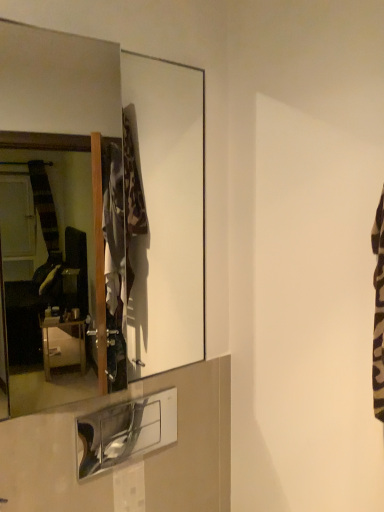
Question: From the image's perspective, is metallic silver shelf at lower center on top of matte glass mirror at upper left?

Choices:
 (A) yes
 (B) no

Answer: (B)

Question: Would you consider metallic silver shelf at lower center to be distant from matte glass mirror at upper left?

Choices:
 (A) yes
 (B) no

Answer: (A)

Question: From a real-world perspective, does metallic silver shelf at lower center sit lower than matte glass mirror at upper left?

Choices:
 (A) yes
 (B) no

Answer: (A)

Question: Does metallic silver shelf at lower center have a larger size compared to matte glass mirror at upper left?

Choices:
 (A) yes
 (B) no

Answer: (B)

Question: Considering the relative positions of metallic silver shelf at lower center and matte glass mirror at upper left in the image provided, is metallic silver shelf at lower center to the left of matte glass mirror at upper left from the viewer's perspective?

Choices:
 (A) yes
 (B) no

Answer: (B)

Question: Can you see metallic silver shelf at lower center touching matte glass mirror at upper left?

Choices:
 (A) no
 (B) yes

Answer: (A)

Question: Does matte glass mirror at upper left contain metallic silver shelf at lower center?

Choices:
 (A) no
 (B) yes

Answer: (A)

Question: Is matte glass mirror at upper left bigger than metallic silver shelf at lower center?

Choices:
 (A) no
 (B) yes

Answer: (B)

Question: From the image's perspective, is matte glass mirror at upper left under metallic silver shelf at lower center?

Choices:
 (A) yes
 (B) no

Answer: (B)

Question: Is matte glass mirror at upper left aimed at metallic silver shelf at lower center?

Choices:
 (A) yes
 (B) no

Answer: (B)

Question: From a real-world perspective, does matte glass mirror at upper left stand above metallic silver shelf at lower center?

Choices:
 (A) yes
 (B) no

Answer: (A)

Question: From the image's perspective, would you say matte glass mirror at upper left is positioned over metallic silver shelf at lower center?

Choices:
 (A) yes
 (B) no

Answer: (A)

Question: Is matte glass mirror at upper left to the left or to the right of metallic silver shelf at lower center in the image?

Choices:
 (A) right
 (B) left

Answer: (B)